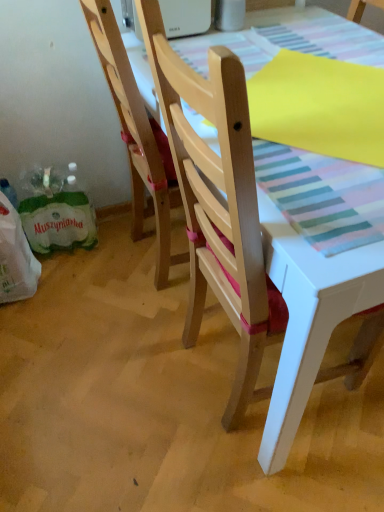
I want to click on vacant space in front of green paper shopping bag at lower left, so click(x=66, y=283).